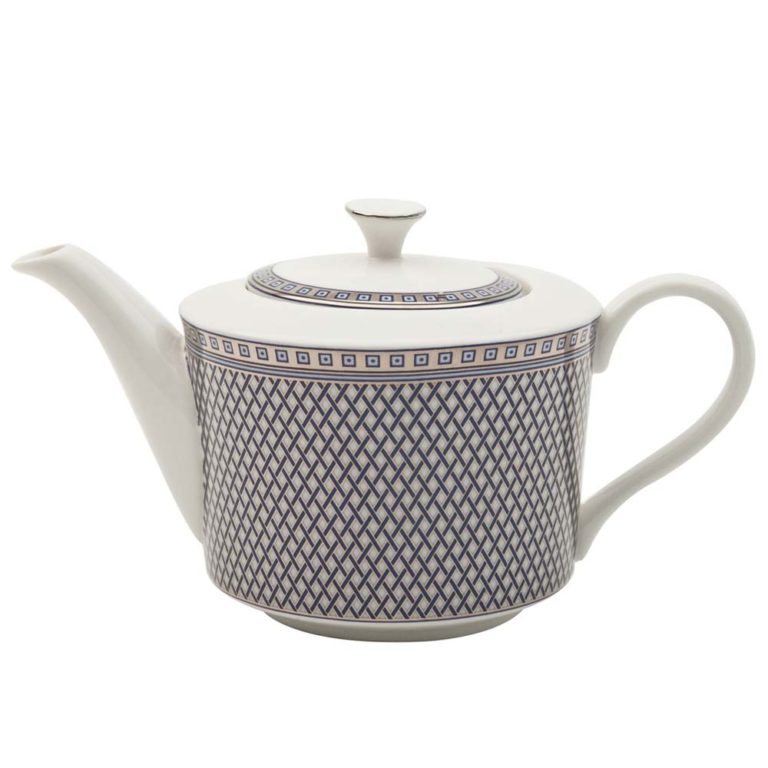
This screenshot has height=768, width=768. I want to click on teapot handle, so click(730, 308).